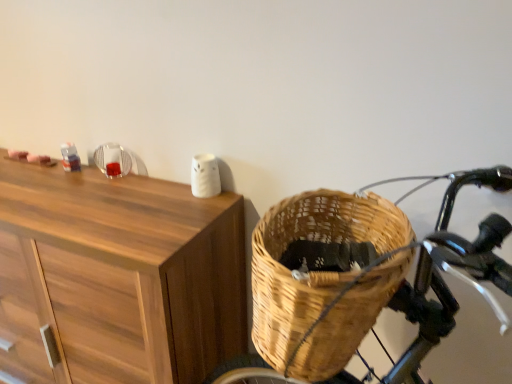
Find the location of `wooden cabinet at upper left`. wooden cabinet at upper left is located at coordinates (117, 277).

What do you see at coordinates (117, 277) in the screenshot? I see `wooden cabinet at upper left` at bounding box center [117, 277].

Image resolution: width=512 pixels, height=384 pixels. Identify the location of wooden cabinet at upper left. (117, 277).